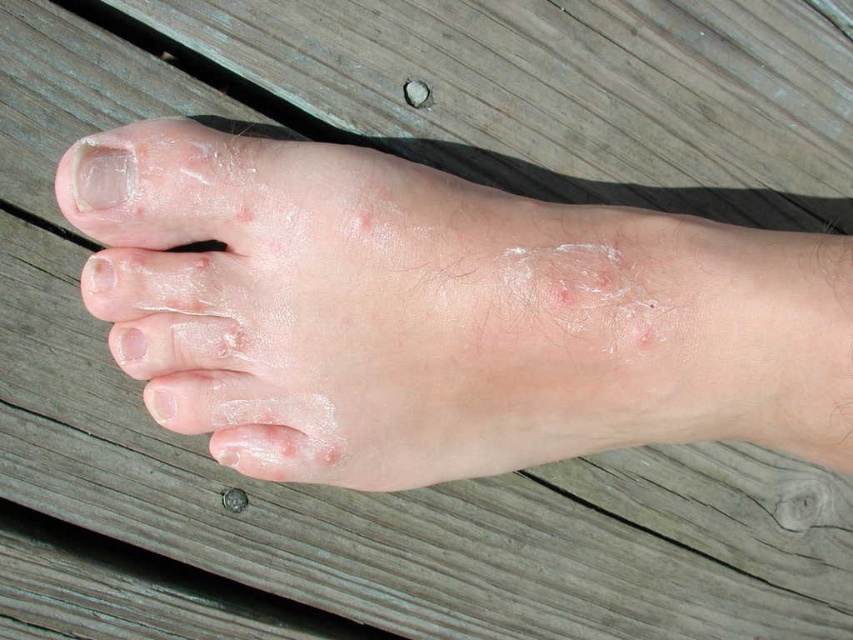
Question: Does dry skin at center have a larger size compared to white matte nail at upper left?

Choices:
 (A) yes
 (B) no

Answer: (A)

Question: Is dry skin at center to the left of white matte nail at upper left from the viewer's perspective?

Choices:
 (A) no
 (B) yes

Answer: (A)

Question: Which point appears closest to the camera in this image?

Choices:
 (A) (344, 252)
 (B) (115, 189)

Answer: (A)

Question: Which point appears farthest from the camera in this image?

Choices:
 (A) (134, 186)
 (B) (283, 179)

Answer: (A)

Question: From the image, what is the correct spatial relationship of dry skin at center in relation to white matte nail at upper left?

Choices:
 (A) right
 (B) left

Answer: (A)